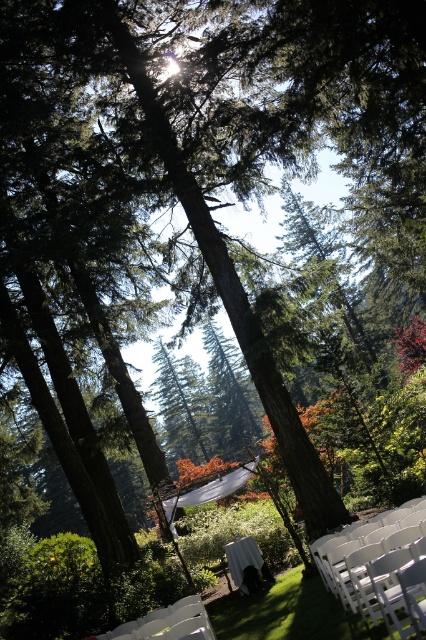
Question: Which of the following is the farthest from the observer?

Choices:
 (A) [101, 634]
 (B) [334, 582]

Answer: (A)

Question: Is white plastic chair at lower right positioned in front of white plastic chair at lower center?

Choices:
 (A) no
 (B) yes

Answer: (A)

Question: Which point appears closest to the camera in this image?

Choices:
 (A) (178, 630)
 (B) (394, 531)

Answer: (A)

Question: Observing the image, what is the correct spatial positioning of white plastic chair at lower right in reference to white plastic chair at lower center?

Choices:
 (A) right
 (B) left

Answer: (A)

Question: Which of the following is the closest to the observer?

Choices:
 (A) white plastic chair at lower center
 (B) white plastic chair at lower right

Answer: (A)

Question: Is white plastic chair at lower right closer to camera compared to white plastic chair at lower center?

Choices:
 (A) yes
 (B) no

Answer: (B)